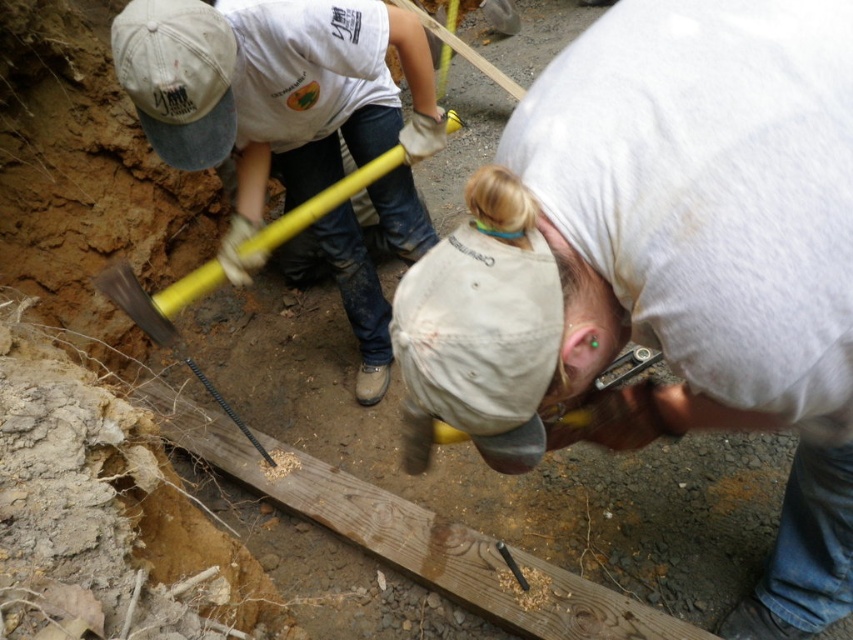
Question: Which object appears farthest from the camera in this image?

Choices:
 (A) yellow rubber hammer at center
 (B) yellow metal shovel at lower left

Answer: (B)

Question: Can you confirm if yellow rubber hammer at center is positioned to the right of yellow metal shovel at lower left?

Choices:
 (A) yes
 (B) no

Answer: (A)

Question: Can you confirm if yellow rubber hammer at center is smaller than yellow metal shovel at lower left?

Choices:
 (A) yes
 (B) no

Answer: (B)

Question: Does yellow rubber hammer at center appear over yellow metal shovel at lower left?

Choices:
 (A) yes
 (B) no

Answer: (A)